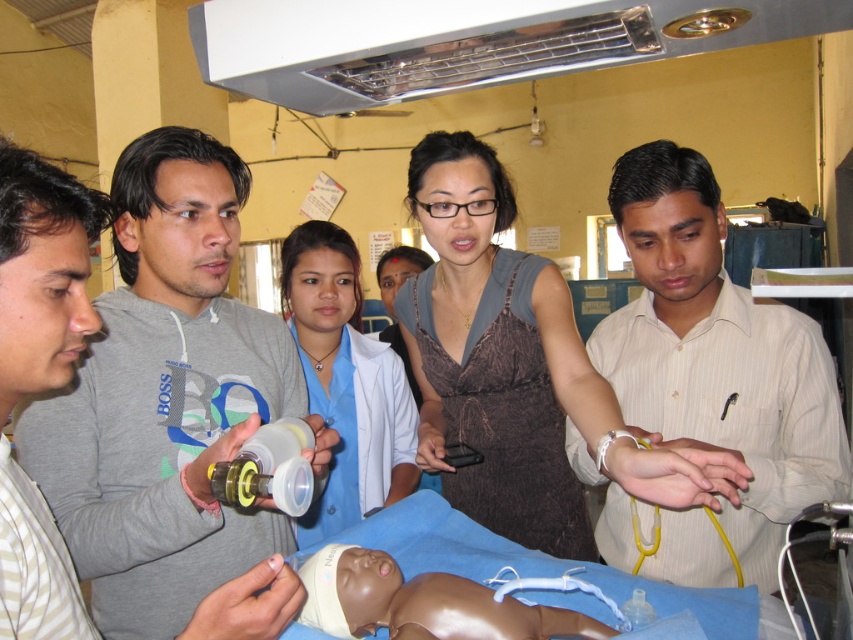
Question: Which point appears closest to the camera in this image?

Choices:
 (A) (238, 205)
 (B) (392, 628)

Answer: (B)

Question: Can you confirm if white striped shirt at center is smaller than brown satin dress at center?

Choices:
 (A) yes
 (B) no

Answer: (A)

Question: Observing the image, what is the correct spatial positioning of blue uniform at center in reference to brown rubber baby at center?

Choices:
 (A) left
 (B) right

Answer: (A)

Question: Does white striped shirt at center have a larger size compared to brown rubber baby at center?

Choices:
 (A) no
 (B) yes

Answer: (B)

Question: Based on their relative distances, which object is farther from the brown rubber baby at center?

Choices:
 (A) brown satin dress at center
 (B) white striped shirt at center

Answer: (B)

Question: Which point is closer to the camera?

Choices:
 (A) blue uniform at center
 (B) brown rubber baby at center

Answer: (B)